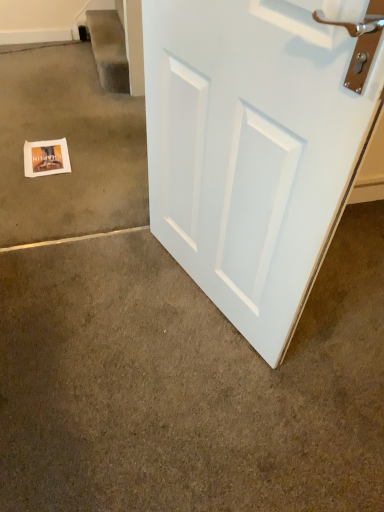
Identify the location of free point above white matte door at center, which is counted as the 2th concrete, starting from the back (from a real-world perspective). This screenshot has width=384, height=512. (232, 355).